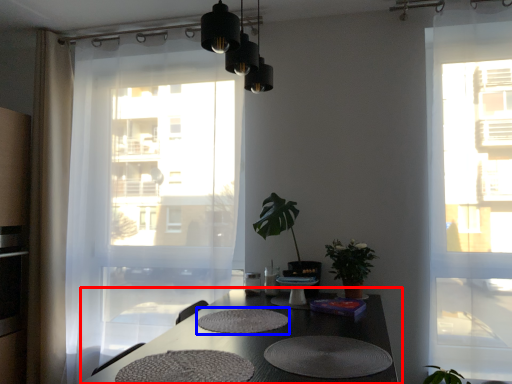
Question: Among these objects, which one is nearest to the camera, table (highlighted by a red box) or mat (highlighted by a blue box)?

Choices:
 (A) table
 (B) mat

Answer: (A)